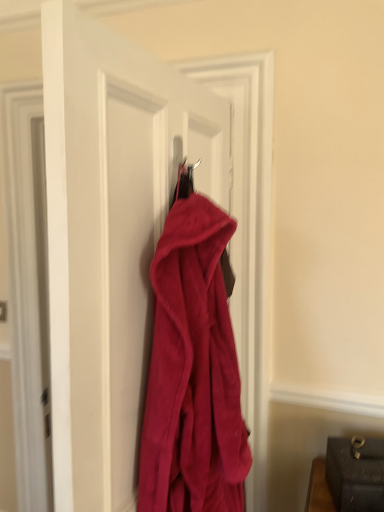
Question: Which is correct: velvet red coat at center is inside fuzzy red coat at center, or outside of it?

Choices:
 (A) inside
 (B) outside

Answer: (B)

Question: Does point (115, 168) appear closer or farther from the camera than point (180, 424)?

Choices:
 (A) closer
 (B) farther

Answer: (A)

Question: From a real-world perspective, is velvet red coat at center positioned above or below fuzzy red coat at center?

Choices:
 (A) above
 (B) below

Answer: (A)

Question: From a real-world perspective, is fuzzy red coat at center physically located above or below velvet red coat at center?

Choices:
 (A) above
 (B) below

Answer: (B)

Question: Is point (182, 214) positioned closer to the camera than point (125, 219)?

Choices:
 (A) closer
 (B) farther

Answer: (B)

Question: Looking at the image, does fuzzy red coat at center seem bigger or smaller compared to velvet red coat at center?

Choices:
 (A) big
 (B) small

Answer: (B)

Question: From the image's perspective, is fuzzy red coat at center above or below velvet red coat at center?

Choices:
 (A) above
 (B) below

Answer: (B)